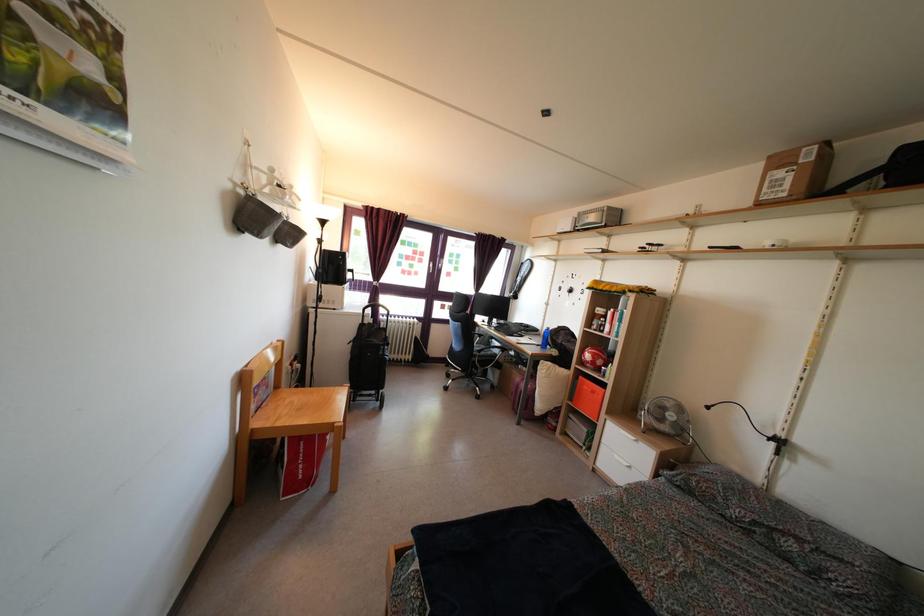
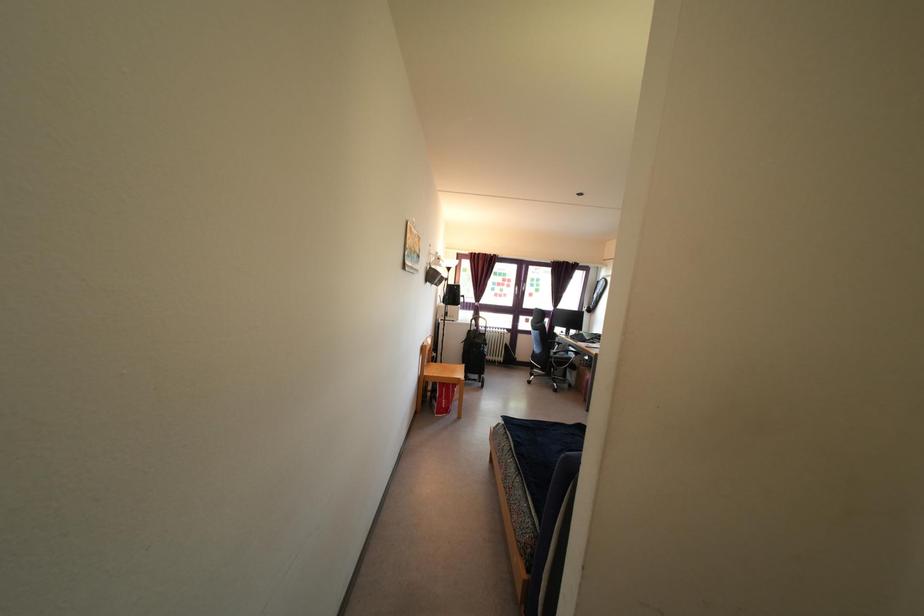
In the second image, find the point that corresponds to [423,543] in the first image.

(507, 427)